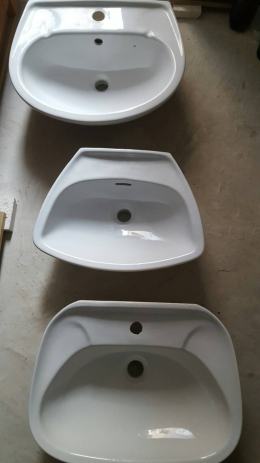
Where is `sink front`? Image resolution: width=260 pixels, height=463 pixels. sink front is located at coordinates 85,460, 148,265, 96,117.